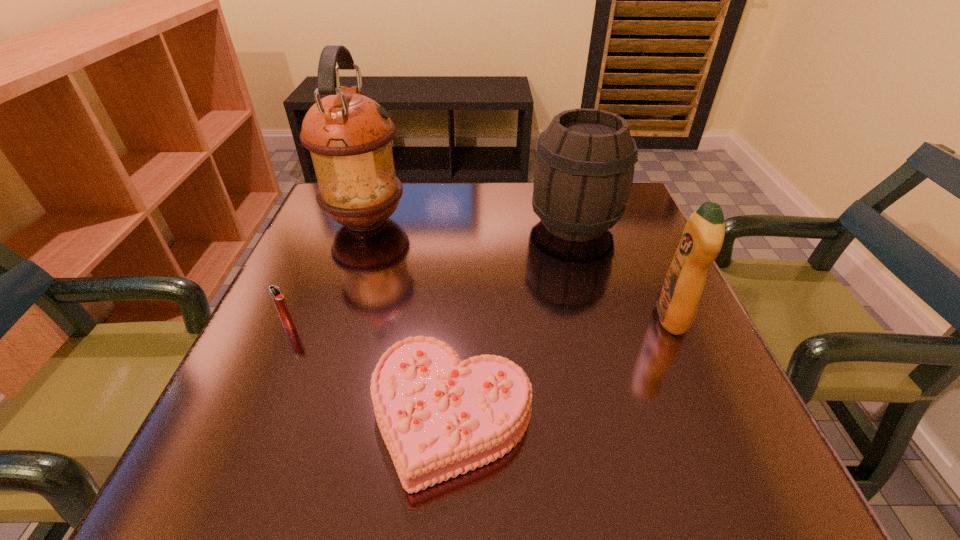
Find the location of a particular element. This screenshot has width=960, height=540. blank region between the igniter and the detergent is located at coordinates (480, 321).

Where is `vacant space that is in between the detergent and the tallest object`? The width and height of the screenshot is (960, 540). vacant space that is in between the detergent and the tallest object is located at coordinates (518, 269).

I want to click on empty space that is in between the igniter and the third object from left to right, so 370,370.

Where is `vacant space that's between the oil lamp and the igniter`? The image size is (960, 540). vacant space that's between the oil lamp and the igniter is located at coordinates (327, 273).

Identify the location of free spot between the third object from right to left and the oil lamp. This screenshot has height=540, width=960. (409, 319).

Find the location of a particular element. This screenshot has width=960, height=540. free space between the wine bucket and the shortest object is located at coordinates (513, 320).

The image size is (960, 540). Find the location of `vacant region between the third object from right to left and the wine bucket`. vacant region between the third object from right to left and the wine bucket is located at coordinates (513, 320).

The image size is (960, 540). I want to click on free space between the nearest object and the fourth tallest object, so click(x=370, y=370).

Identify which object is the nearest to the tallest object. Please provide its 2D coordinates. Your answer should be formatted as a tuple, i.e. [(x, y)], where the tuple contains the x and y coordinates of a point satisfying the conditions above.

[(279, 301)]

I want to click on object that can be found as the third closest to the wine bucket, so click(439, 417).